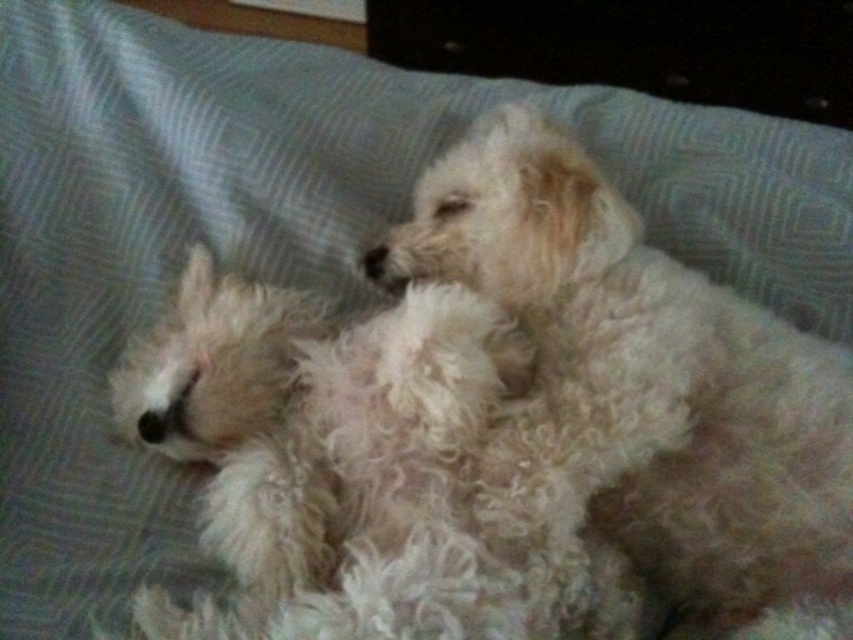
Is fluffy white dog at center thinner than white fluffy dog at center?

Indeed, fluffy white dog at center has a lesser width compared to white fluffy dog at center.

Is fluffy white dog at center below white fluffy dog at center?

Incorrect, fluffy white dog at center is not positioned below white fluffy dog at center.

Locate an element on the screen. This screenshot has height=640, width=853. fluffy white dog at center is located at coordinates (639, 390).